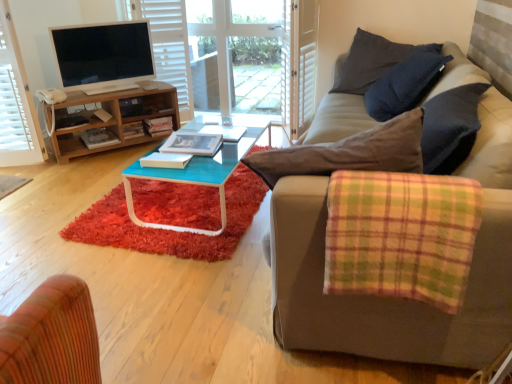
Question: From their relative heights in the image, would you say matte black tv at upper left is taller or shorter than dark gray cotton pillow at upper right?

Choices:
 (A) tall
 (B) short

Answer: (B)

Question: From a real-world perspective, is matte black tv at upper left positioned above or below dark gray cotton pillow at upper right?

Choices:
 (A) below
 (B) above

Answer: (B)

Question: Which object is positioned closest to the white plastic phone at left?

Choices:
 (A) white wood screen door at upper center
 (B) transparent glass door at upper center
 (C) plaid fabric studio couch at right
 (D) dark gray cotton pillow at upper right
 (E) matte black tv at upper left

Answer: (E)

Question: Which is farther from the plaid fabric cushion at right?

Choices:
 (A) white wood screen door at upper center
 (B) shaggy red rug at center
 (C) white plastic phone at left
 (D) dark gray cotton pillow at upper right
 (E) white sheer curtain at upper left

Answer: (E)